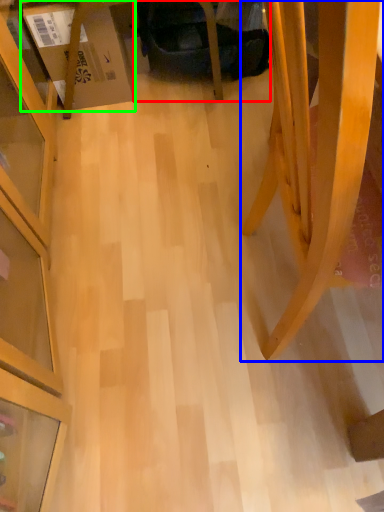
Question: Considering the real-world distances, which object is farthest from swivel chair (highlighted by a red box)? furniture (highlighted by a blue box) or cardboard box (highlighted by a green box)?

Choices:
 (A) furniture
 (B) cardboard box

Answer: (A)